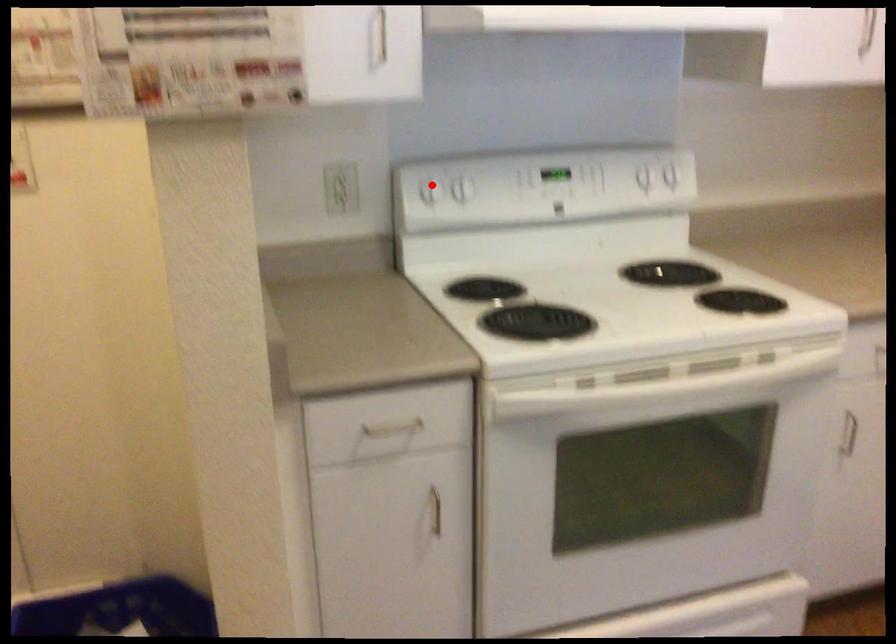
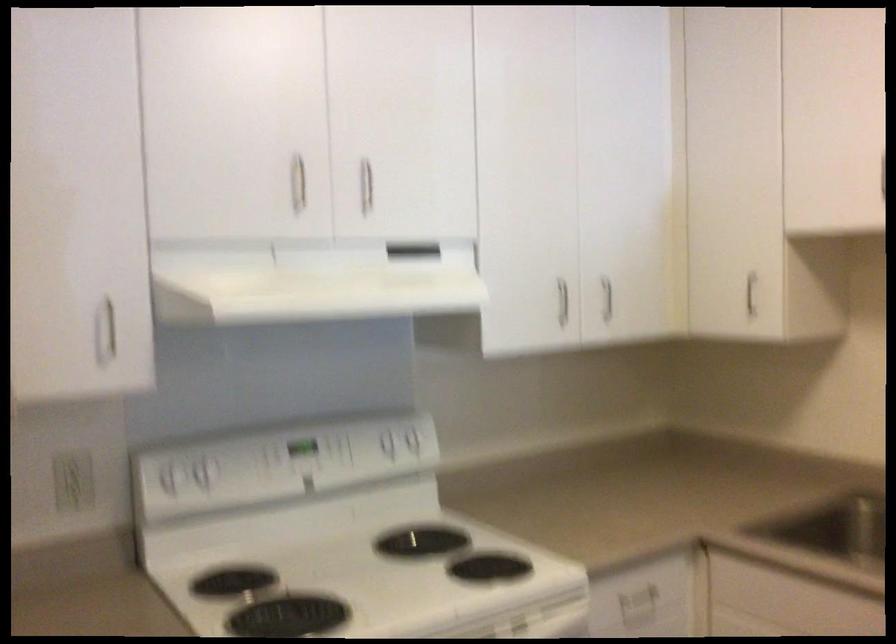
In the second image, find the point that corresponds to the highlighted location in the first image.

(169, 476)